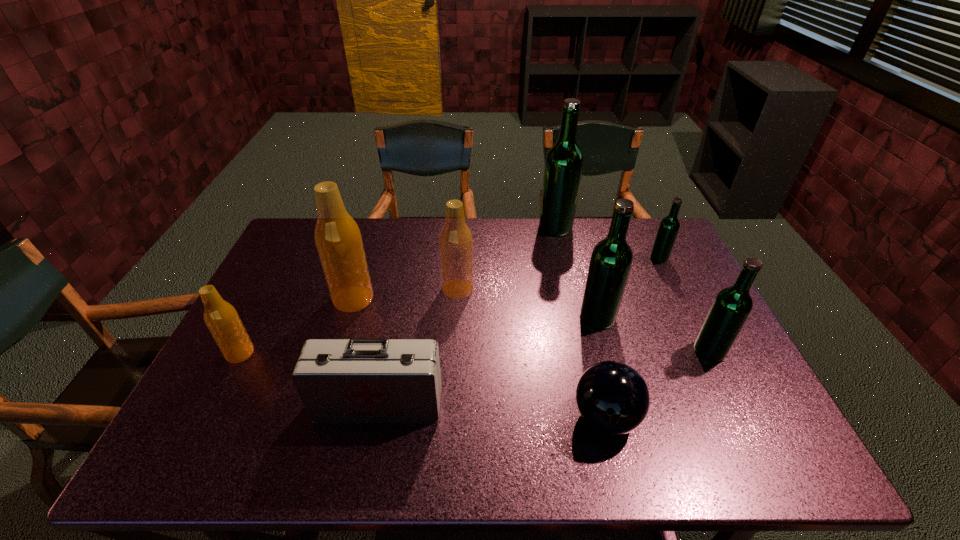
Identify the location of the leftmost beer bottle. (221, 318).

Where is `the leftmost object`? the leftmost object is located at coordinates (221, 318).

I want to click on red first-aid kit, so click(359, 379).

Locate an element on the screen. the first-aid kit is located at coordinates (359, 379).

Find the location of a particular element. black bowling ball is located at coordinates point(612,397).

Where is `the shortest object`? Image resolution: width=960 pixels, height=540 pixels. the shortest object is located at coordinates (612, 397).

Where is `free space located 0.340m on the front of the farthest object`? free space located 0.340m on the front of the farthest object is located at coordinates (573, 306).

Where is `free space located on the left of the second nearest green beer bottle`? The image size is (960, 540). free space located on the left of the second nearest green beer bottle is located at coordinates (488, 317).

Where is `free space located 0.300m on the back of the second tan beer bottle from right to left`? free space located 0.300m on the back of the second tan beer bottle from right to left is located at coordinates point(375,229).

The image size is (960, 540). Identify the location of vacant area situated 0.060m on the front of the nearest green beer bottle. (726, 383).